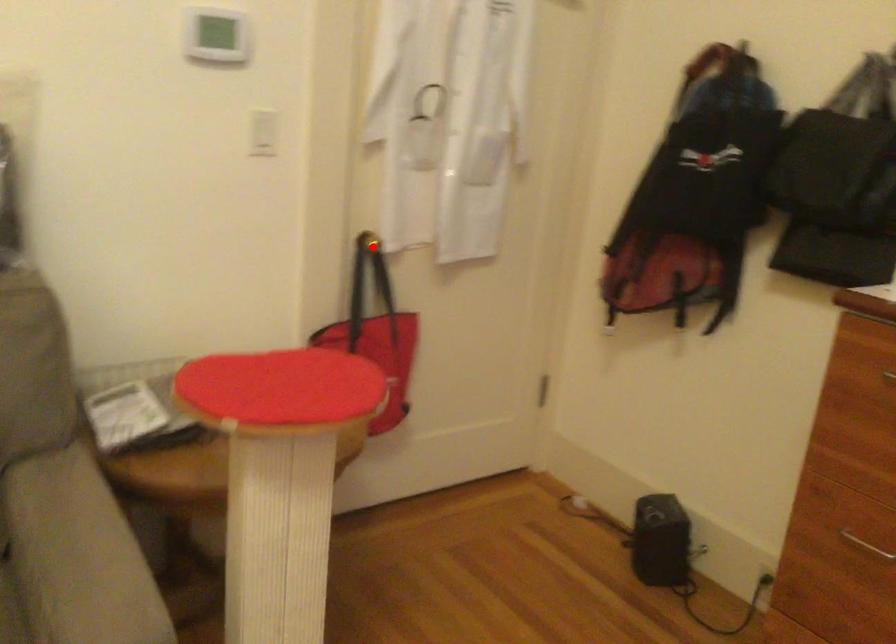
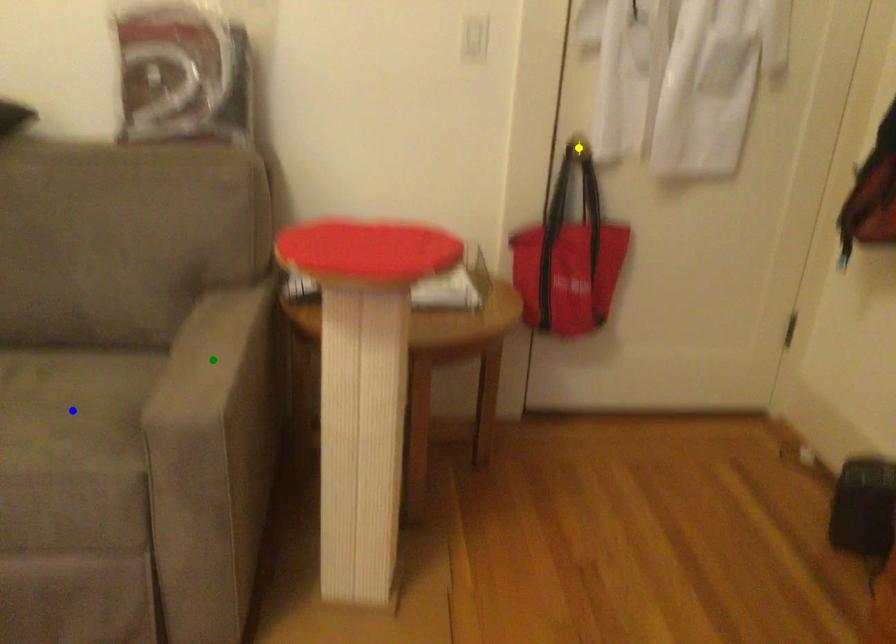
Question: I am providing you with two images of the same scene from different viewpoints. A red point is marked on the first image. You are given multiple points on the second image. Which point in image 2 represents the same 3d spot as the red point in image 1?

Choices:
 (A) blue point
 (B) green point
 (C) yellow point

Answer: (C)